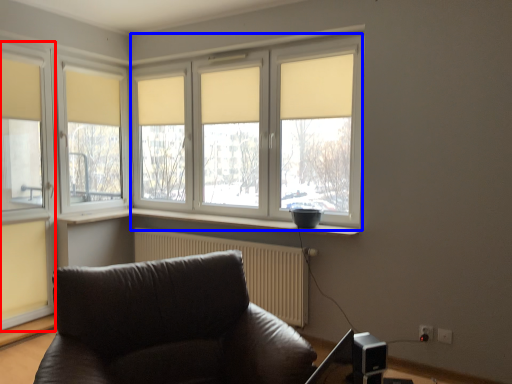
Question: Among these objects, which one is farthest to the camera, window (highlighted by a red box) or bay window (highlighted by a blue box)?

Choices:
 (A) window
 (B) bay window

Answer: (A)